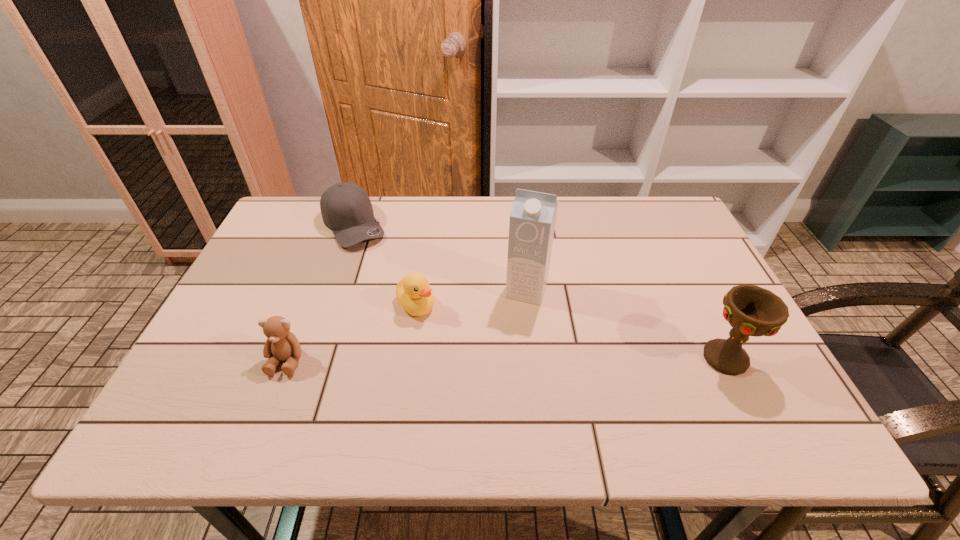
What are the coordinates of `object that is the closest one to the teddy bear` in the screenshot? It's located at (414, 295).

Where is `free region that satisfies the following two spatial constraints: 1. on the front side of the second tallest object; 2. on the left side of the third object from right to left`? free region that satisfies the following two spatial constraints: 1. on the front side of the second tallest object; 2. on the left side of the third object from right to left is located at coordinates pos(408,358).